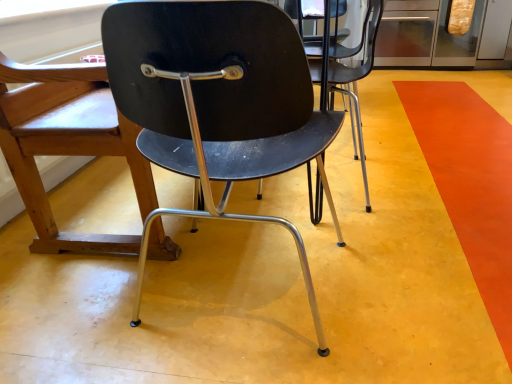
Describe the element at coordinates (216, 101) in the screenshot. I see `matte black chair at center, the 2th chair from the back` at that location.

I want to click on orange matte floor at lower right, so click(x=470, y=183).

Find the location of a particular element. This screenshot has height=384, width=512. matte black chair at center, the 2th chair when ordered from front to back is located at coordinates (66, 144).

Identify the location of matte black chair at center, the 2th chair from the back. The height and width of the screenshot is (384, 512). (216, 101).

From the image's perspective, between matte black chair at center, the 1th chair viewed from the front, and orange matte floor at lower right, who is located below?

matte black chair at center, the 1th chair viewed from the front, from the image's perspective.

Between matte black chair at center, the 2th chair from the back, and orange matte floor at lower right, which one has larger width?

orange matte floor at lower right.

Does matte black chair at center, the 2th chair from the back, have a lesser height compared to orange matte floor at lower right?

Incorrect, the height of matte black chair at center, the 2th chair from the back, does not fall short of that of orange matte floor at lower right.

Locate an element on the screen. chair located in front of the orange matte floor at lower right is located at coordinates 216,101.

From their relative heights in the image, would you say orange matte floor at lower right is taller or shorter than matte black chair at center, the 1th chair viewed from the front?

In the image, orange matte floor at lower right appears to be shorter than matte black chair at center, the 1th chair viewed from the front.

Is point (496, 317) closer to viewer compared to point (177, 167)?

That is False.

From the image's perspective, is orange matte floor at lower right located above or below matte black chair at center, the 1th chair viewed from the front?

orange matte floor at lower right is above matte black chair at center, the 1th chair viewed from the front.

Is there a large distance between orange matte floor at lower right and matte black chair at center, the 2th chair when ordered from front to back?

orange matte floor at lower right is positioned a significant distance from matte black chair at center, the 2th chair when ordered from front to back.

Can you tell me how much orange matte floor at lower right and matte black chair at center, the 2th chair when ordered from front to back, differ in facing direction?

The angular difference between orange matte floor at lower right and matte black chair at center, the 2th chair when ordered from front to back, is 89.4 degrees.

Considering the sizes of objects orange matte floor at lower right and matte black chair at center, the 2th chair when ordered from front to back, in the image provided, who is bigger, orange matte floor at lower right or matte black chair at center, the 2th chair when ordered from front to back,?

matte black chair at center, the 2th chair when ordered from front to back.

Which object is further away from the camera, matte black chair at center, the 2th chair when ordered from front to back, or orange matte floor at lower right?

matte black chair at center, the 2th chair when ordered from front to back, is more distant.

Is matte black chair at center, which is the 1th chair in back-to-front order, to the left of orange matte floor at lower right from the viewer's perspective?

Yes.

Between point (78, 139) and point (476, 180), which one is positioned behind?

The point (476, 180) is farther.

Considering the sizes of objects matte black chair at center, which is the 1th chair in back-to-front order, and orange matte floor at lower right in the image provided, who is bigger, matte black chair at center, which is the 1th chair in back-to-front order, or orange matte floor at lower right?

With larger size is matte black chair at center, which is the 1th chair in back-to-front order.

Is matte black chair at center, the 2th chair from the back, not close to matte black chair at center, the 2th chair when ordered from front to back?

matte black chair at center, the 2th chair from the back, is near matte black chair at center, the 2th chair when ordered from front to back, not far away.

Locate an element on the screen. The height and width of the screenshot is (384, 512). chair that appears above the matte black chair at center, the 1th chair viewed from the front (from the image's perspective) is located at coordinates (66, 144).

Is matte black chair at center, which is the 1th chair in back-to-front order, at the back of matte black chair at center, the 1th chair viewed from the front?

No, matte black chair at center, the 1th chair viewed from the front, is not facing the opposite direction of matte black chair at center, which is the 1th chair in back-to-front order.

Considering the positions of point (196, 6) and point (39, 110), is point (196, 6) closer or farther from the camera than point (39, 110)?

Clearly, point (196, 6) is closer to the camera than point (39, 110).

Who is more distant, matte black chair at center, which is the 1th chair in back-to-front order, or matte black chair at center, the 1th chair viewed from the front?

matte black chair at center, which is the 1th chair in back-to-front order, is further away from the camera.

Is matte black chair at center, the 2th chair when ordered from front to back, touching matte black chair at center, the 1th chair viewed from the front?

No, matte black chair at center, the 2th chair when ordered from front to back, is not next to matte black chair at center, the 1th chair viewed from the front.

Does matte black chair at center, the 2th chair when ordered from front to back, turn towards matte black chair at center, the 1th chair viewed from the front?

Yes, matte black chair at center, the 2th chair when ordered from front to back, is turned towards matte black chair at center, the 1th chair viewed from the front.

Locate an element on the screen. The height and width of the screenshot is (384, 512). strip on the right of matte black chair at center, the 1th chair viewed from the front is located at coordinates (470, 183).

From a real-world perspective, which chair is the 1st one above the orange matte floor at lower right? Please provide its 2D coordinates.

[(216, 101)]

When comparing their distances from orange matte floor at lower right, does matte black chair at center, which is the 1th chair in back-to-front order, or matte black chair at center, the 2th chair from the back, seem further?

matte black chair at center, which is the 1th chair in back-to-front order, lies further to orange matte floor at lower right than the other object.

Looking at the image, which one is located further to matte black chair at center, which is the 1th chair in back-to-front order, matte black chair at center, the 2th chair from the back, or orange matte floor at lower right?

orange matte floor at lower right lies further to matte black chair at center, which is the 1th chair in back-to-front order, than the other object.

From the image, which object appears to be farther from matte black chair at center, the 2th chair from the back, orange matte floor at lower right or matte black chair at center, the 2th chair when ordered from front to back?

The object further to matte black chair at center, the 2th chair from the back, is orange matte floor at lower right.

Based on their spatial positions, is matte black chair at center, the 1th chair viewed from the front, or matte black chair at center, which is the 1th chair in back-to-front order, further from orange matte floor at lower right?

matte black chair at center, which is the 1th chair in back-to-front order, is positioned further to the anchor orange matte floor at lower right.

In the scene shown: Looking at the image, which one is located closer to matte black chair at center, the 2th chair from the back, matte black chair at center, which is the 1th chair in back-to-front order, or orange matte floor at lower right?

matte black chair at center, which is the 1th chair in back-to-front order, is positioned closer to the anchor matte black chair at center, the 2th chair from the back.

Based on their spatial positions, is orange matte floor at lower right or matte black chair at center, the 1th chair viewed from the front, closer to matte black chair at center, the 2th chair when ordered from front to back?

matte black chair at center, the 1th chair viewed from the front, is positioned closer to the anchor matte black chair at center, the 2th chair when ordered from front to back.

You are a GUI agent. You are given a task and a screenshot of the screen. Output one action in this format:
    pyautogui.click(x=<x>, y=<y>)
    Task: Click on the chair situated between matte black chair at center, which is the 1th chair in back-to-front order, and orange matte floor at lower right from left to right
    This screenshot has height=384, width=512.
    Given the screenshot: What is the action you would take?
    pyautogui.click(x=216, y=101)